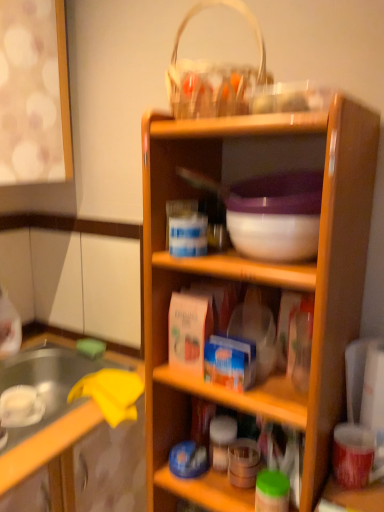
Where is `wooden shelf at center`? wooden shelf at center is located at coordinates (257, 279).

Describe the element at coordinates (84, 461) in the screenshot. Image resolution: width=384 pixels, height=512 pixels. I see `wooden cabinet at center` at that location.

Where is `white woven basket at upper center`? Image resolution: width=384 pixels, height=512 pixels. white woven basket at upper center is located at coordinates (213, 74).

Can you confirm if wooden shelf at center is smaller than white woven basket at upper center?

No, wooden shelf at center is not smaller than white woven basket at upper center.

Which object is thinner, wooden shelf at center or white woven basket at upper center?

white woven basket at upper center.

From the image's perspective, which is below, wooden shelf at center or white woven basket at upper center?

wooden shelf at center, from the image's perspective.

Are wooden shelf at center and white woven basket at upper center beside each other?

They are not placed beside each other.

What are the coordinates of `basket that is above the wooden cabinet at center (from a real-world perspective)` in the screenshot? It's located at [x=213, y=74].

Between white woven basket at upper center and wooden cabinet at center, which one has larger width?

wooden cabinet at center is wider.

Consider the image. Is white woven basket at upper center beside wooden cabinet at center?

white woven basket at upper center and wooden cabinet at center are not in contact.

From the image's perspective, would you say white woven basket at upper center is shown under wooden cabinet at center?

No, from the image's perspective, white woven basket at upper center is not below wooden cabinet at center.

Considering the relative positions of wooden cabinet at center and wooden shelf at center in the image provided, is wooden cabinet at center behind wooden shelf at center?

Yes, the depth of wooden cabinet at center is greater than that of wooden shelf at center.

Consider the image. Could you tell me if wooden cabinet at center is turned towards wooden shelf at center?

Yes, wooden cabinet at center is aimed at wooden shelf at center.

Is wooden cabinet at center in contact with wooden shelf at center?

No, wooden cabinet at center is not touching wooden shelf at center.

Is wooden cabinet at center to the right of white woven basket at upper center from the viewer's perspective?

No, wooden cabinet at center is not to the right of white woven basket at upper center.

Is wooden cabinet at center facing towards white woven basket at upper center?

No, wooden cabinet at center is not turned towards white woven basket at upper center.

Considering the positions of objects wooden cabinet at center and white woven basket at upper center in the image provided, who is in front, wooden cabinet at center or white woven basket at upper center?

white woven basket at upper center.

From the image's perspective, is wooden cabinet at center located beneath white woven basket at upper center?

Correct, wooden cabinet at center appears lower than white woven basket at upper center in the image.

Locate an element on the screen. This screenshot has width=384, height=512. cabinetry below the wooden shelf at center (from a real-world perspective) is located at coordinates (84, 461).

Considering the sizes of objects wooden shelf at center and wooden cabinet at center in the image provided, who is thinner, wooden shelf at center or wooden cabinet at center?

With smaller width is wooden shelf at center.

Which object is further away from the camera taking this photo, wooden shelf at center or wooden cabinet at center?

wooden cabinet at center is behind.

From a real-world perspective, between wooden shelf at center and wooden cabinet at center, who is vertically higher?

From a 3D spatial view, wooden shelf at center is above.

How many degrees apart are the facing directions of white woven basket at upper center and wooden shelf at center?

0.000709 degrees separate the facing orientations of white woven basket at upper center and wooden shelf at center.

Is white woven basket at upper center not close to wooden shelf at center?

No.

Is white woven basket at upper center taller or shorter than wooden shelf at center?

Clearly, white woven basket at upper center is shorter compared to wooden shelf at center.

Measure the distance between white woven basket at upper center and wooden shelf at center.

A distance of 12.78 inches exists between white woven basket at upper center and wooden shelf at center.

Locate an element on the screen. The height and width of the screenshot is (512, 384). basket located above the wooden shelf at center (from a real-world perspective) is located at coordinates (213, 74).

The height and width of the screenshot is (512, 384). I want to click on basket that appears in front of the wooden cabinet at center, so click(213, 74).

When comparing their distances from wooden shelf at center, does wooden cabinet at center or white woven basket at upper center seem further?

wooden cabinet at center lies further to wooden shelf at center than the other object.

Based on their spatial positions, is wooden cabinet at center or wooden shelf at center closer to white woven basket at upper center?

Among the two, wooden shelf at center is located nearer to white woven basket at upper center.

Which object lies nearer to the anchor point wooden cabinet at center, white woven basket at upper center or wooden shelf at center?

The object closer to wooden cabinet at center is wooden shelf at center.

Estimate the real-world distances between objects in this image. Which object is closer to wooden shelf at center, white woven basket at upper center or wooden cabinet at center?

Based on the image, white woven basket at upper center appears to be nearer to wooden shelf at center.

When comparing their distances from wooden cabinet at center, does wooden shelf at center or white woven basket at upper center seem further?

white woven basket at upper center.

Considering their positions, is wooden shelf at center positioned further to white woven basket at upper center than wooden cabinet at center?

wooden cabinet at center.

Locate an element on the screen. The height and width of the screenshot is (512, 384). shelf between white woven basket at upper center and wooden cabinet at center from top to bottom is located at coordinates (257, 279).